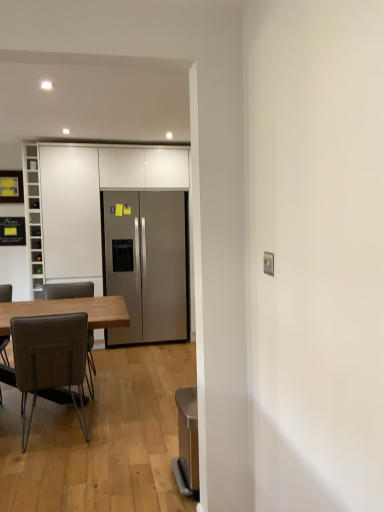
Question: Should I look upward or downward to see brown leather chair at left, marked as the second chair in a front-to-back arrangement?

Choices:
 (A) up
 (B) down

Answer: (B)

Question: Considering the relative sizes of brown leather chair at left, marked as the second chair in a front-to-back arrangement, and brown leather chair at left, which appears as the 1th chair when viewed from the front, in the image provided, is brown leather chair at left, marked as the second chair in a front-to-back arrangement, taller than brown leather chair at left, which appears as the 1th chair when viewed from the front,?

Choices:
 (A) no
 (B) yes

Answer: (A)

Question: From the image's perspective, is brown leather chair at left, marked as the second chair in a front-to-back arrangement, above brown leather chair at left, which appears as the 1th chair when viewed from the front?

Choices:
 (A) yes
 (B) no

Answer: (A)

Question: Considering the relative sizes of brown leather chair at left, marked as the second chair in a front-to-back arrangement, and brown leather chair at left, which appears as the 1th chair when viewed from the front, in the image provided, is brown leather chair at left, marked as the second chair in a front-to-back arrangement, thinner than brown leather chair at left, which appears as the 1th chair when viewed from the front,?

Choices:
 (A) yes
 (B) no

Answer: (B)

Question: Is brown leather chair at left, marked as the second chair in a front-to-back arrangement, in front of brown leather chair at left, the 2th chair positioned from the back?

Choices:
 (A) yes
 (B) no

Answer: (B)

Question: Can you confirm if brown leather chair at left, positioned as the first chair in back-to-front order, is bigger than brown leather chair at left, which appears as the 1th chair when viewed from the front?

Choices:
 (A) yes
 (B) no

Answer: (B)

Question: Is brown leather chair at left, positioned as the first chair in back-to-front order, positioned with its back to brown leather chair at left, the 2th chair positioned from the back?

Choices:
 (A) yes
 (B) no

Answer: (B)

Question: Is white glass wine rack at left, acting as the 1th cabinetry starting from the left, shorter than white glossy cabinets at center, which is the second cabinetry in left-to-right order?

Choices:
 (A) yes
 (B) no

Answer: (A)

Question: Can you confirm if white glass wine rack at left, acting as the 1th cabinetry starting from the left, is taller than white glossy cabinets at center, the first cabinetry viewed from the right?

Choices:
 (A) no
 (B) yes

Answer: (A)

Question: Is white glass wine rack at left, acting as the 1th cabinetry starting from the left, at the right side of white glossy cabinets at center, which is the second cabinetry in left-to-right order?

Choices:
 (A) yes
 (B) no

Answer: (B)

Question: Is white glass wine rack at left, acting as the 1th cabinetry starting from the left, located outside white glossy cabinets at center, the first cabinetry viewed from the right?

Choices:
 (A) yes
 (B) no

Answer: (A)

Question: Is white glass wine rack at left, acting as the 1th cabinetry starting from the left, facing away from white glossy cabinets at center, the first cabinetry viewed from the right?

Choices:
 (A) yes
 (B) no

Answer: (B)

Question: Can you confirm if white glass wine rack at left, acting as the 1th cabinetry starting from the left, is bigger than white glossy cabinets at center, which is the second cabinetry in left-to-right order?

Choices:
 (A) yes
 (B) no

Answer: (B)

Question: Is brown leather chair at left, marked as the second chair in a front-to-back arrangement, to the left of wooden table at left from the viewer's perspective?

Choices:
 (A) no
 (B) yes

Answer: (A)